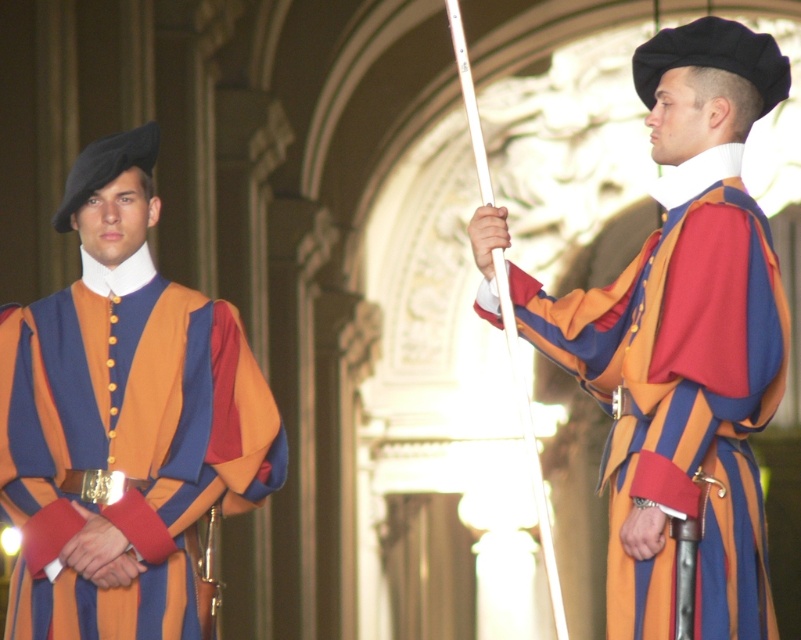
Question: Can you confirm if matte striped robe at center is bigger than matte black beret at left?

Choices:
 (A) yes
 (B) no

Answer: (A)

Question: Which point is farther from the camera taking this photo?

Choices:
 (A) (67, 360)
 (B) (731, 518)

Answer: (A)

Question: Which point appears closest to the camera in this image?

Choices:
 (A) (643, 540)
 (B) (79, 371)

Answer: (A)

Question: Where is matte striped robe at center located in relation to matte black beret at left in the image?

Choices:
 (A) left
 (B) right

Answer: (B)

Question: Is matte striped robe at center below matte black beret at left?

Choices:
 (A) no
 (B) yes

Answer: (A)